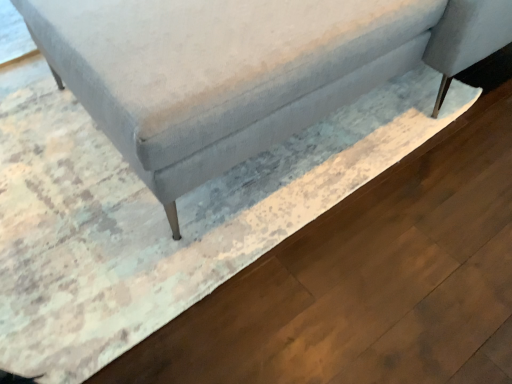
This screenshot has width=512, height=384. Describe the element at coordinates (242, 69) in the screenshot. I see `velvet gray couch at lower center` at that location.

The height and width of the screenshot is (384, 512). What are the coordinates of `velvet gray couch at lower center` in the screenshot? It's located at point(242,69).

The height and width of the screenshot is (384, 512). I want to click on velvet gray couch at lower center, so click(242, 69).